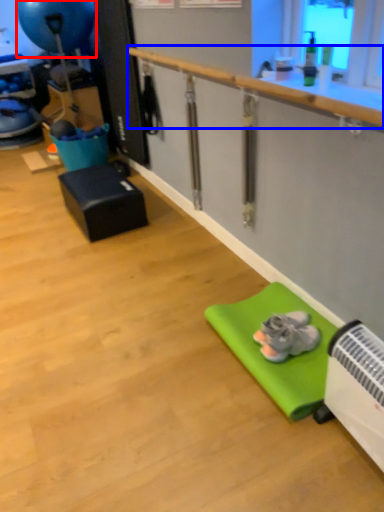
Question: Which of the following is the closest to the observer, balloon (highlighted by a red box) or rail (highlighted by a blue box)?

Choices:
 (A) balloon
 (B) rail

Answer: (B)